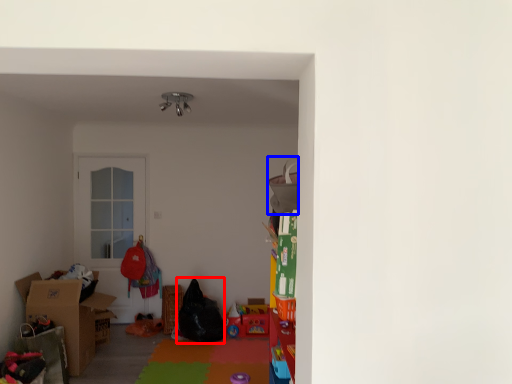
Question: Which of the following is the closest to the observer, bean bag chair (highlighted by a red box) or bean bag chair (highlighted by a blue box)?

Choices:
 (A) bean bag chair
 (B) bean bag chair

Answer: (B)